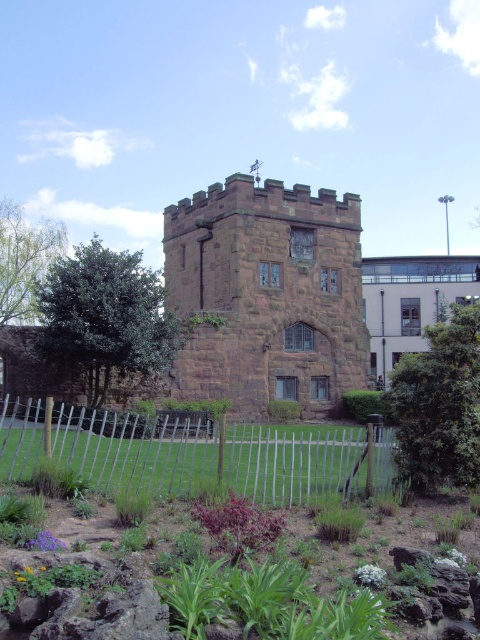
Does point (236, 292) come behind point (31, 429)?

Yes, it is.

Between brown stone tower at center and green leafy plants at lower center, which one is positioned lower?

Positioned lower is green leafy plants at lower center.

Does point (273, 180) lie in front of point (32, 401)?

No, it is behind (32, 401).

Identify the location of brown stone tower at center. This screenshot has width=480, height=640. (257, 308).

Which of these two, brown stone tower at center or white wooden fence at lower center, stands shorter?

With less height is white wooden fence at lower center.

Does brown stone tower at center have a greater width compared to white wooden fence at lower center?

Yes.

Between point (243, 298) and point (294, 492), which one is positioned in front?

Positioned in front is point (294, 492).

Where is `brown stone tower at center`? The height and width of the screenshot is (640, 480). brown stone tower at center is located at coordinates (257, 308).

Looking at this image, who is taller, white wooden fence at lower center or green leafy plants at lower center?

With more height is green leafy plants at lower center.

Which is in front, point (60, 452) or point (6, 468)?

Positioned in front is point (6, 468).

Locate an element on the screen. Image resolution: width=480 pixels, height=640 pixels. white wooden fence at lower center is located at coordinates (219, 456).